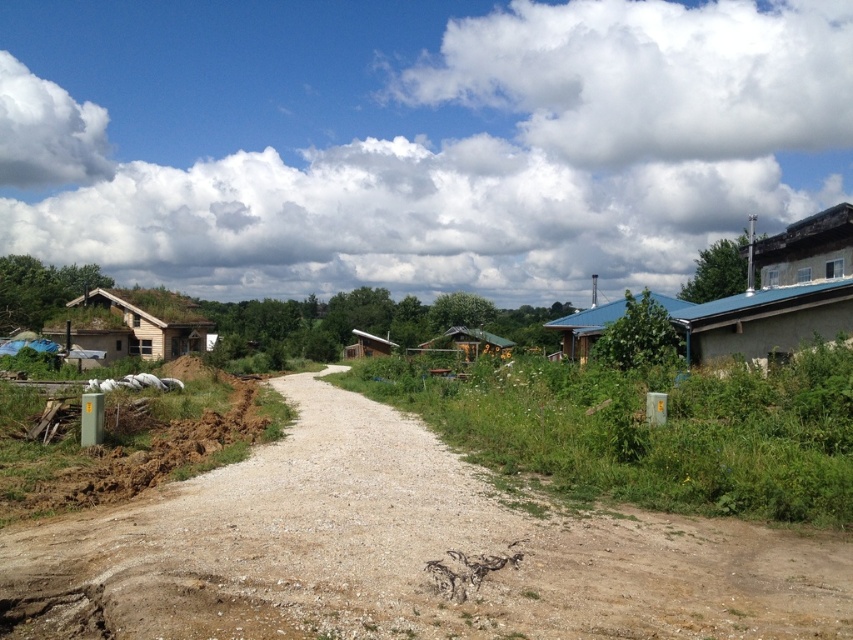
Image resolution: width=853 pixels, height=640 pixels. What do you see at coordinates (152, 321) in the screenshot? I see `brown wooden hut at left` at bounding box center [152, 321].

You are a GUI agent. You are given a task and a screenshot of the screen. Output one action in this format:
    pyautogui.click(x=<x>, y=<y>)
    Task: Click on the brown wooden hut at left
    The width and height of the screenshot is (853, 640).
    Given the screenshot: What is the action you would take?
    pyautogui.click(x=152, y=321)

I want to click on brown wooden hut at left, so click(152, 321).

Can you confirm if rustic wooden hut at upper right is positioned to the right of blue corrugated metal hut at center-right?

In fact, rustic wooden hut at upper right is to the left of blue corrugated metal hut at center-right.

Is rustic wooden hut at upper right smaller than blue corrugated metal hut at center-right?

→ Yes.

Which is behind, point (849, 250) or point (587, 332)?

Positioned behind is point (587, 332).

Where is `rustic wooden hut at upper right`? The image size is (853, 640). rustic wooden hut at upper right is located at coordinates (805, 250).

Does gray concrete hut at right appear on the right side of rustic wooden hut at upper right?

In fact, gray concrete hut at right is to the left of rustic wooden hut at upper right.

Does point (724, 340) come behind point (759, 268)?

No, (724, 340) is in front of (759, 268).

Identify the location of gray concrete hut at right. The width and height of the screenshot is (853, 640). (764, 321).

Image resolution: width=853 pixels, height=640 pixels. In order to click on gray concrete hut at right in this screenshot , I will do `click(764, 321)`.